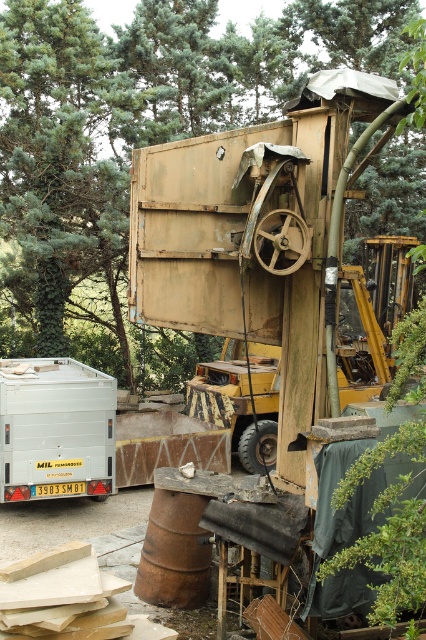
You are a construction worker who needs to determine if the green leafy tree at upper center will block the view of the white matte trailer at lower left when standing at the crane. Based on their heights, will the tree obstruct the view of the trailer?

The green leafy tree at upper center is much taller than the white matte trailer at lower left, so it will likely obstruct the view of the white matte trailer at lower left when standing at the crane.

From the picture: You are a surveyor analyzing the coordinates of the scene. The point at coordinates [138,141] is marked. What object is located at this coordinate?

The point at coordinates [138,141] marks the green leafy tree at upper center.